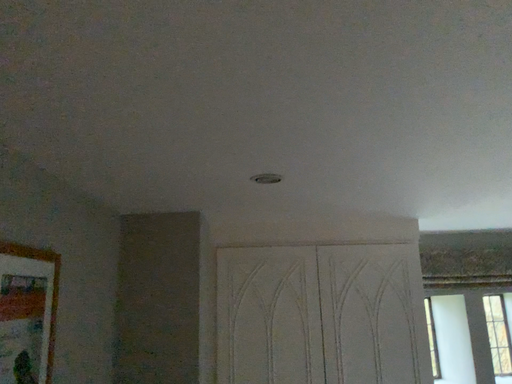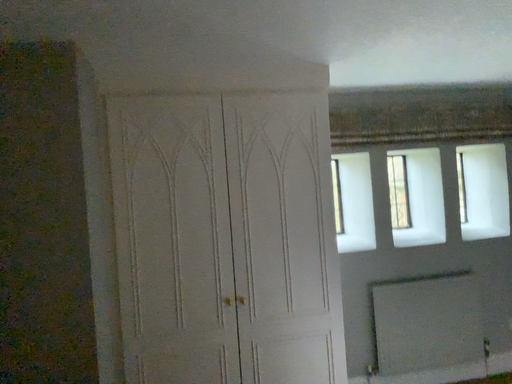
Question: How did the camera likely rotate when shooting the video?

Choices:
 (A) rotated left
 (B) rotated right

Answer: (B)